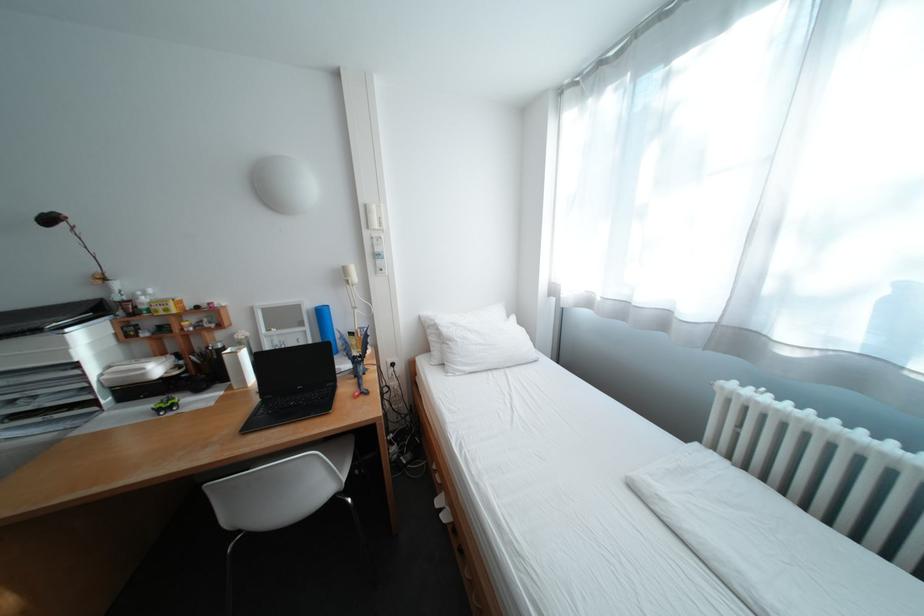
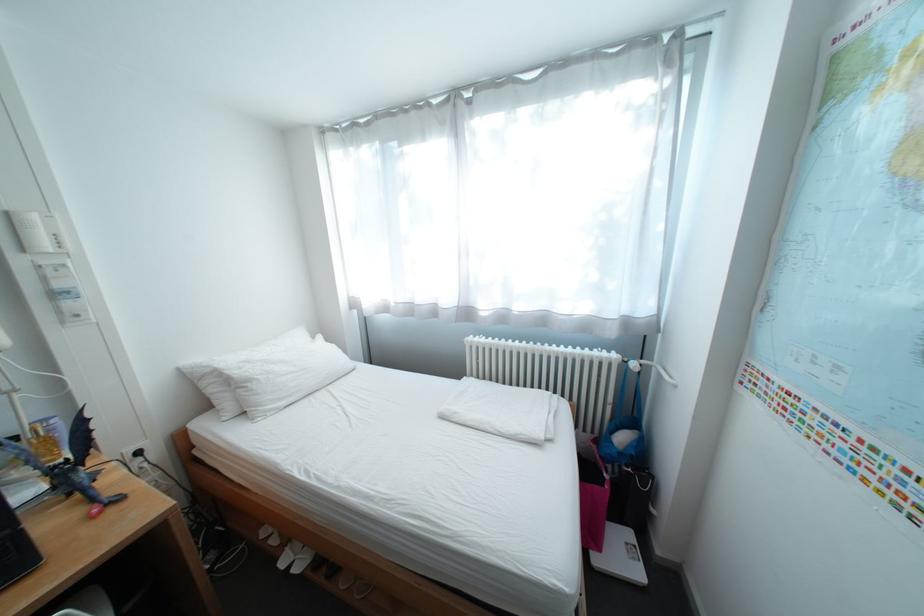
Where in the second image is the point corresponding to the point at 456,509 from the first image?

(307, 562)